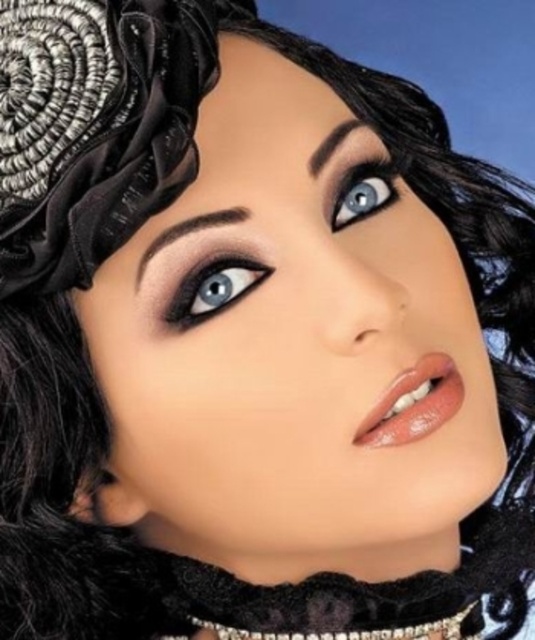
Is satin black headdress at upper left shorter than smokey matte eye at center?

No, satin black headdress at upper left is not shorter than smokey matte eye at center.

Looking at this image, is satin black headdress at upper left below smokey matte eye at center?

No, satin black headdress at upper left is not below smokey matte eye at center.

Is point (49, 291) farther from camera compared to point (254, 269)?

That is True.

Identify the location of satin black headdress at upper left. The width and height of the screenshot is (535, 640). (95, 125).

Is point (210, 266) positioned behind point (357, 195)?

No, it is not.

Who is positioned more to the right, smokey matte eye at center or blue glossy eye at upper center?

Positioned to the right is blue glossy eye at upper center.

Which is in front, point (203, 276) or point (348, 216)?

Point (203, 276) is in front.

This screenshot has height=640, width=535. In order to click on smokey matte eye at center in this screenshot , I will do tap(214, 288).

Image resolution: width=535 pixels, height=640 pixels. I want to click on satin black headdress at upper left, so click(95, 125).

Is satin black headdress at upper left further to the viewer compared to blue glossy eye at upper center?

No, it is in front of blue glossy eye at upper center.

The image size is (535, 640). What do you see at coordinates (95, 125) in the screenshot? I see `satin black headdress at upper left` at bounding box center [95, 125].

Locate an element on the screen. This screenshot has height=640, width=535. satin black headdress at upper left is located at coordinates (95, 125).